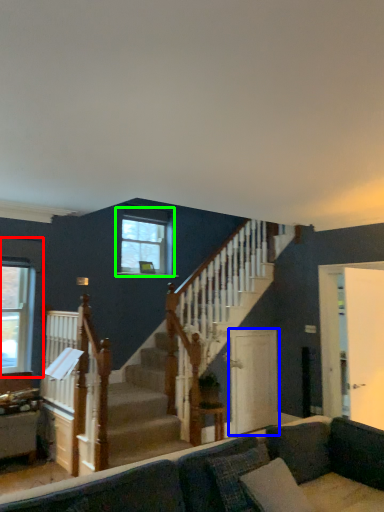
Question: Which object is the closest to the window (highlighted by a red box)? Choose among these: screen door (highlighted by a blue box) or window (highlighted by a green box).

Choices:
 (A) screen door
 (B) window

Answer: (B)